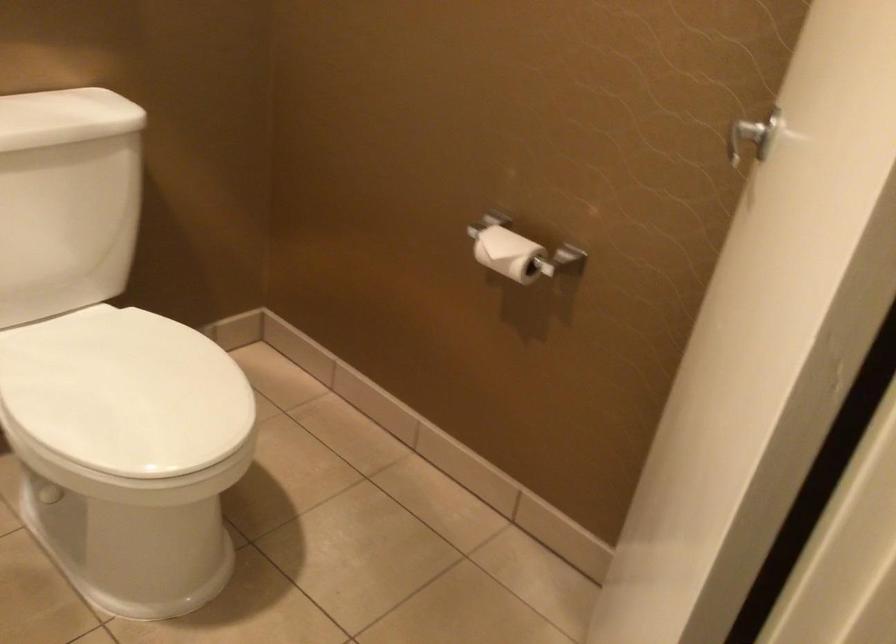
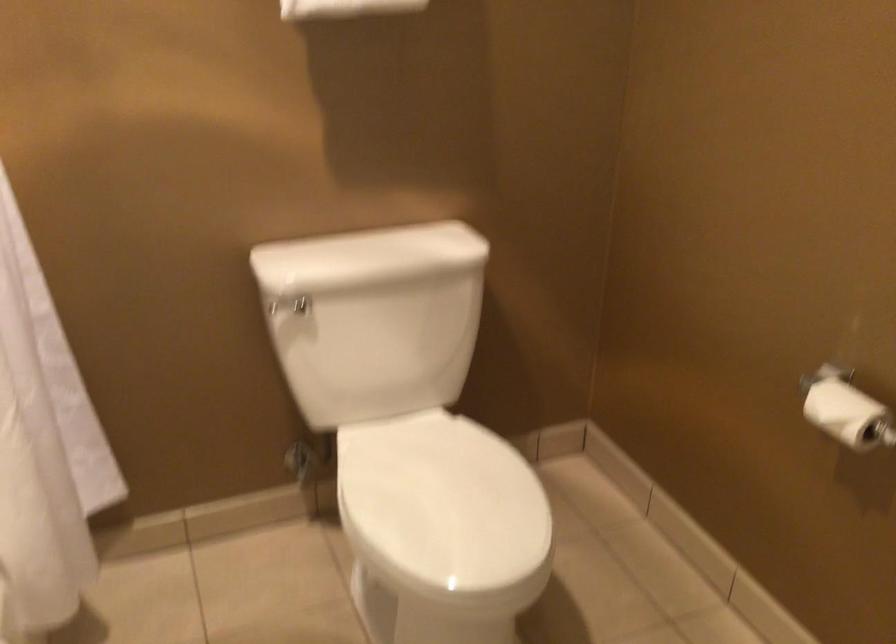
Question: What movement of the cameraman would produce the second image?

Choices:
 (A) Left
 (B) Right
 (C) Forward
 (D) Backward

Answer: (B)